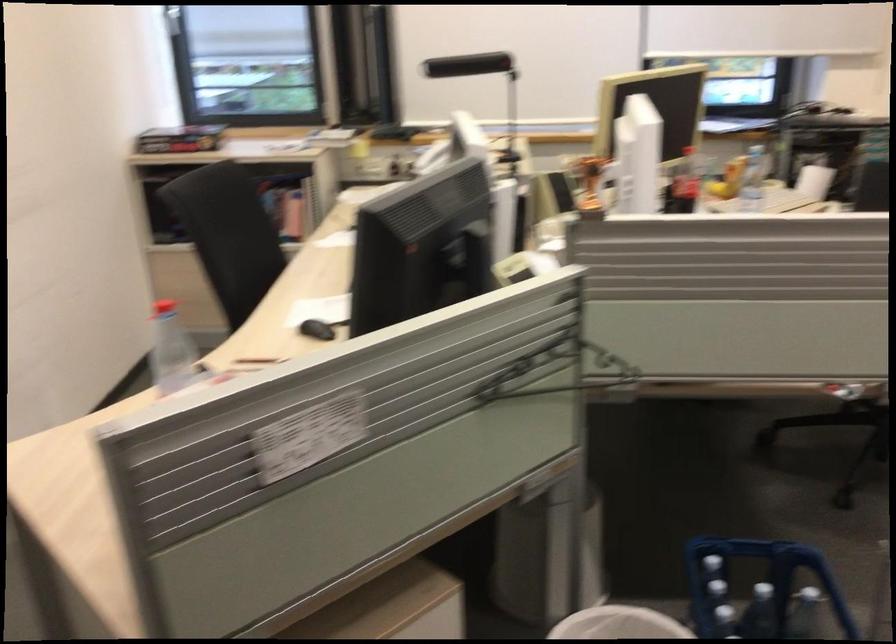
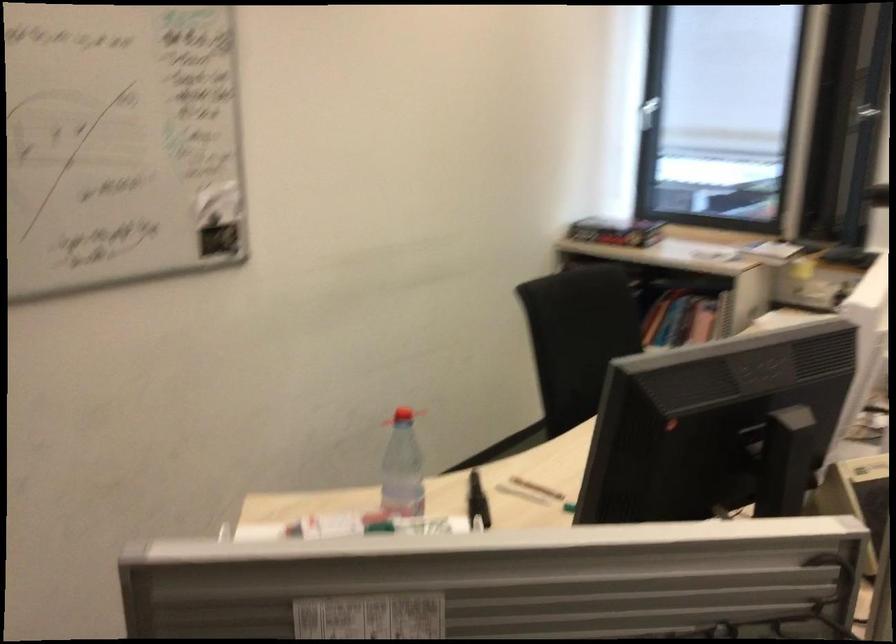
Find the pixel in the second image that matches the point at 170,363 in the first image.

(401, 469)